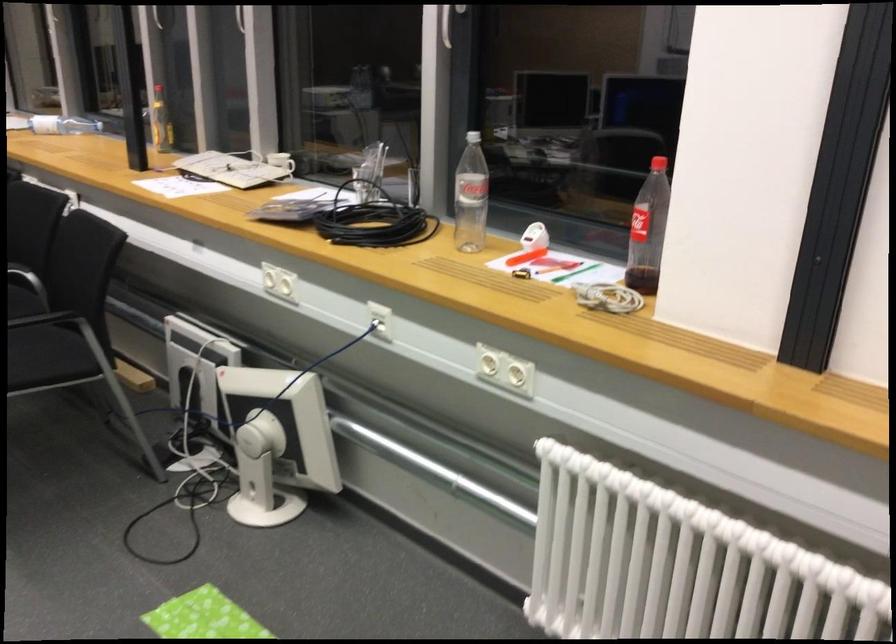
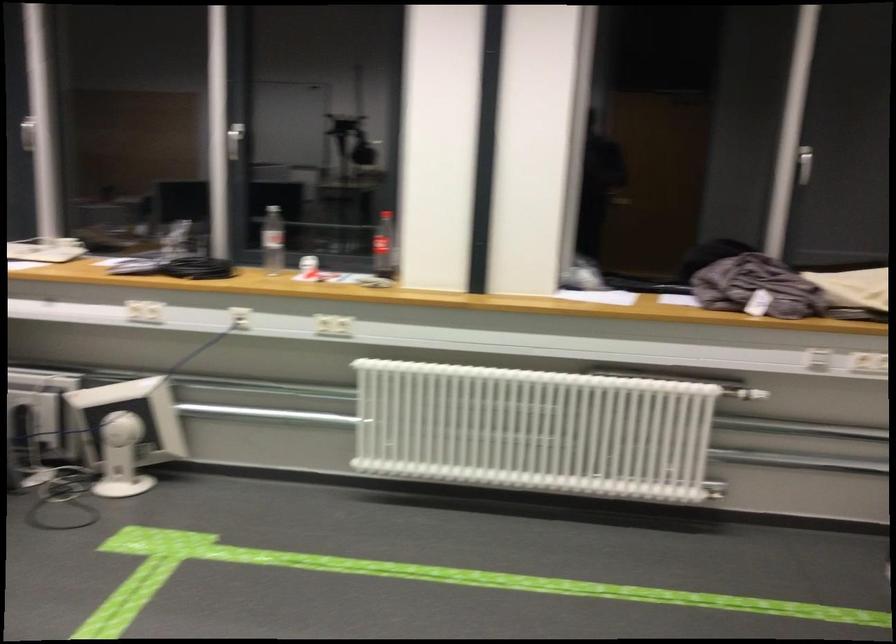
Where in the second image is the point corresponding to (x=259, y=438) from the first image?

(126, 431)